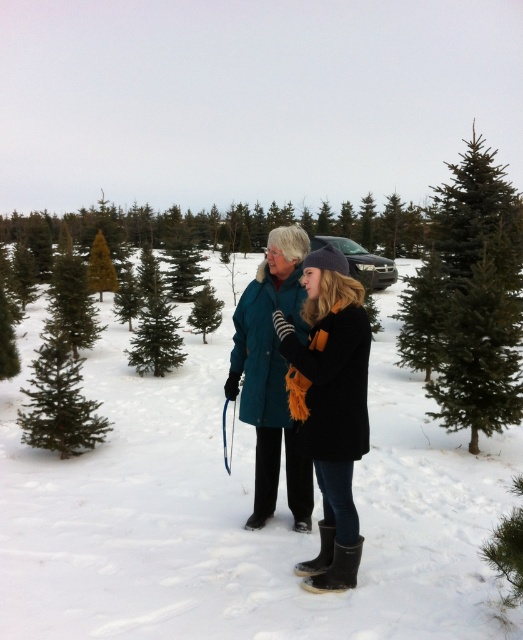
Which is below, green needle-like fir tree at upper right or green matte/fir tree at left?

green matte/fir tree at left is below.

Is green needle-like fir tree at upper right below green matte/fir tree at left?

No.

Does point (415, 326) come closer to viewer compared to point (38, 413)?

No, (415, 326) is behind (38, 413).

Identify the location of green needle-like fir tree at upper right. (470, 300).

Which is below, white fluffy snow at center or green matte/fir tree at left?

white fluffy snow at center

Which is behind, point (245, 580) or point (82, 413)?

The point (82, 413) is more distant.

The image size is (523, 640). Identify the location of white fluffy snow at center. (241, 512).

Is white fluffy snow at center shorter than teal wool coat at center?

Yes.

The height and width of the screenshot is (640, 523). Find the location of `white fluffy snow at center`. white fluffy snow at center is located at coordinates (241, 512).